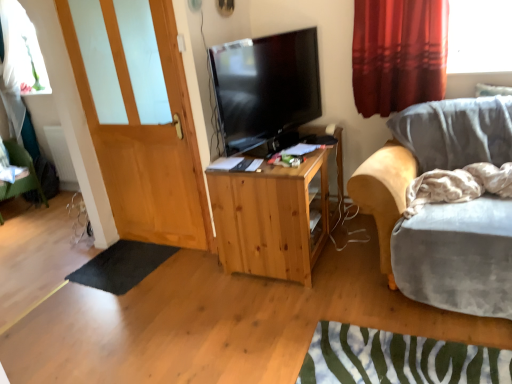
Question: Is black rubber mat at lower left aimed at velvet grey chair at right?

Choices:
 (A) yes
 (B) no

Answer: (B)

Question: Can you confirm if black rubber mat at lower left is positioned to the left of velvet grey chair at right?

Choices:
 (A) no
 (B) yes

Answer: (B)

Question: From the image's perspective, is black rubber mat at lower left below velvet grey chair at right?

Choices:
 (A) yes
 (B) no

Answer: (A)

Question: Is black rubber mat at lower left oriented away from velvet grey chair at right?

Choices:
 (A) no
 (B) yes

Answer: (A)

Question: From the image's perspective, does black rubber mat at lower left appear higher than velvet grey chair at right?

Choices:
 (A) no
 (B) yes

Answer: (A)

Question: Is black glossy tv at center to the left or to the right of black rubber mat at lower left in the image?

Choices:
 (A) right
 (B) left

Answer: (A)

Question: Considering the positions of black glossy tv at center and black rubber mat at lower left in the image, is black glossy tv at center taller or shorter than black rubber mat at lower left?

Choices:
 (A) short
 (B) tall

Answer: (B)

Question: In terms of width, does black glossy tv at center look wider or thinner when compared to black rubber mat at lower left?

Choices:
 (A) wide
 (B) thin

Answer: (B)

Question: Based on their sizes in the image, would you say black glossy tv at center is bigger or smaller than black rubber mat at lower left?

Choices:
 (A) small
 (B) big

Answer: (B)

Question: Choose the correct answer: Is black glossy tv at center inside white matte radiator at lower left or outside it?

Choices:
 (A) outside
 (B) inside

Answer: (A)

Question: Based on their sizes in the image, would you say black glossy tv at center is bigger or smaller than white matte radiator at lower left?

Choices:
 (A) small
 (B) big

Answer: (B)

Question: Is black glossy tv at center wider or thinner than white matte radiator at lower left?

Choices:
 (A) thin
 (B) wide

Answer: (B)

Question: From their relative heights in the image, would you say black glossy tv at center is taller or shorter than white matte radiator at lower left?

Choices:
 (A) short
 (B) tall

Answer: (B)

Question: Is natural wood cabinet at center wider or thinner than velvet grey chair at right?

Choices:
 (A) thin
 (B) wide

Answer: (A)

Question: Is natural wood cabinet at center in front of or behind velvet grey chair at right in the image?

Choices:
 (A) behind
 (B) front

Answer: (A)